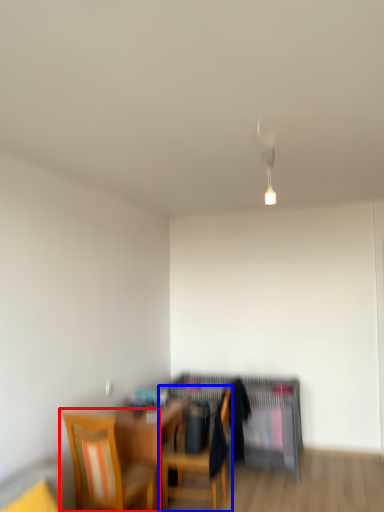
Question: Which object is closer to the camera taking this photo, chair (highlighted by a red box) or chair (highlighted by a blue box)?

Choices:
 (A) chair
 (B) chair

Answer: (A)